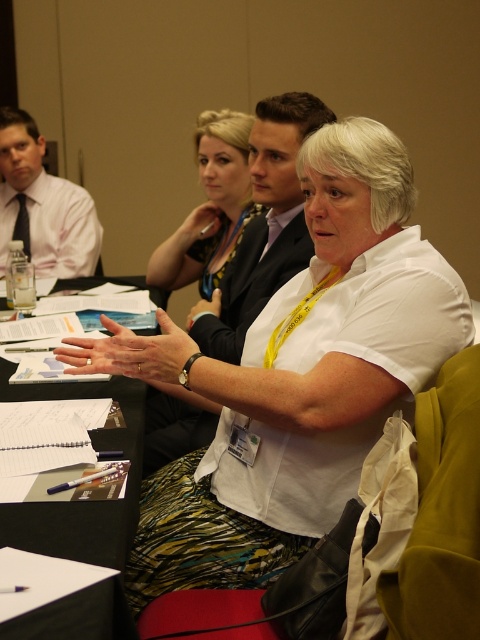
Is black paper at center taller than matte black suit at upper center?

No, black paper at center is not taller than matte black suit at upper center.

Which is more to the left, black paper at center or matte black suit at upper center?

black paper at center

The image size is (480, 640). What do you see at coordinates (82, 500) in the screenshot?
I see `black paper at center` at bounding box center [82, 500].

Where is `black paper at center`? This screenshot has height=640, width=480. black paper at center is located at coordinates (82, 500).

Where is `matte black suit at center`? Image resolution: width=480 pixels, height=640 pixels. matte black suit at center is located at coordinates (263, 227).

Does matte black suit at center have a lesser width compared to matte white shirt at left?

Incorrect, matte black suit at center's width is not less than matte white shirt at left's.

This screenshot has width=480, height=640. Find the location of `matte black suit at center`. matte black suit at center is located at coordinates tap(263, 227).

Identify the location of matte black suit at center. (263, 227).

Does matte black suit at center appear on the right side of matte black suit at upper center?

Correct, you'll find matte black suit at center to the right of matte black suit at upper center.

Who is taller, matte black suit at center or matte black suit at upper center?

Standing taller between the two is matte black suit at center.

This screenshot has height=640, width=480. I want to click on matte black suit at center, so click(x=263, y=227).